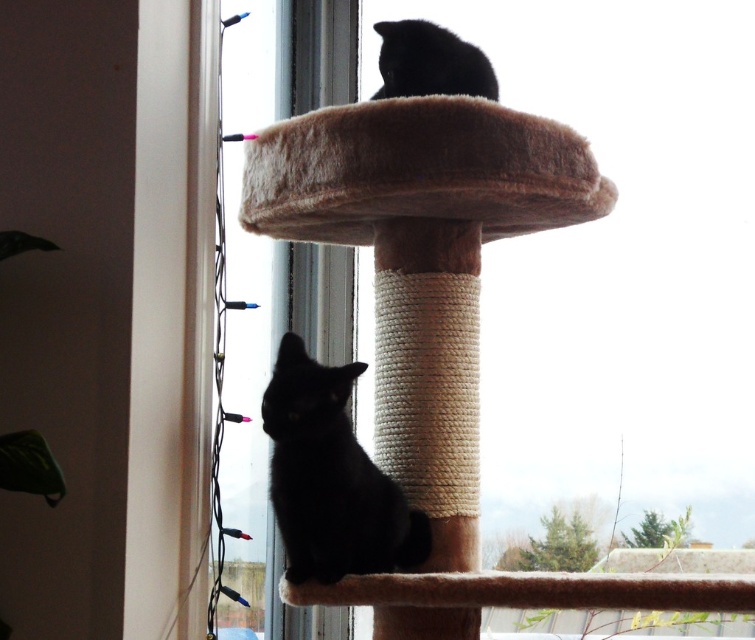
You are a cat owner who wants to ensure your cats have enough space on their cat tree. Given that the brown fuzzy cat bed at upper center and the black fur cat at upper center are currently positioned on the top platform, can you determine if there is enough space between them for another small cat to fit in between?

The brown fuzzy cat bed at upper center and the black fur cat at upper center are 5.50 inches apart from each other. Since 5.50 inches is a narrow space, it may not be sufficient for another small cat to comfortably fit between them.

You are a cat owner who wants to ensure both cats can see each other while resting on the cat tree. Based on their positions, can the black matte cat at lower center see the black fur cat at upper center?

The black matte cat at lower center is below the black fur cat at upper center, so it can see the black fur cat at upper center as it is positioned above.

You are a cat owner who wants to ensure both your cats have enough space to rest. Given the brown fuzzy cat bed at upper center and the black matte cat at lower center, which one provides more room for the cats?

The brown fuzzy cat bed at upper center is bigger than the black matte cat at lower center, so it provides more room for the cats.